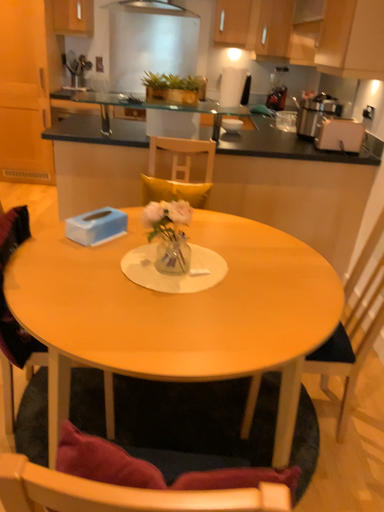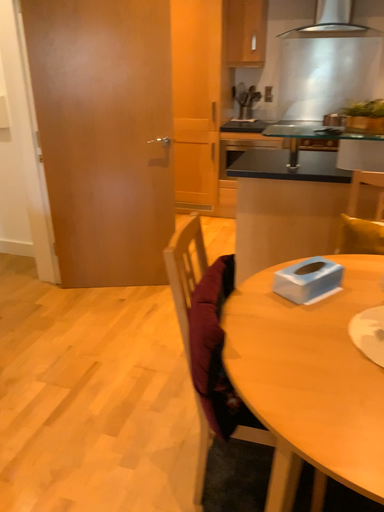
Question: How did the camera likely rotate when shooting the video?

Choices:
 (A) rotated left
 (B) rotated right

Answer: (A)